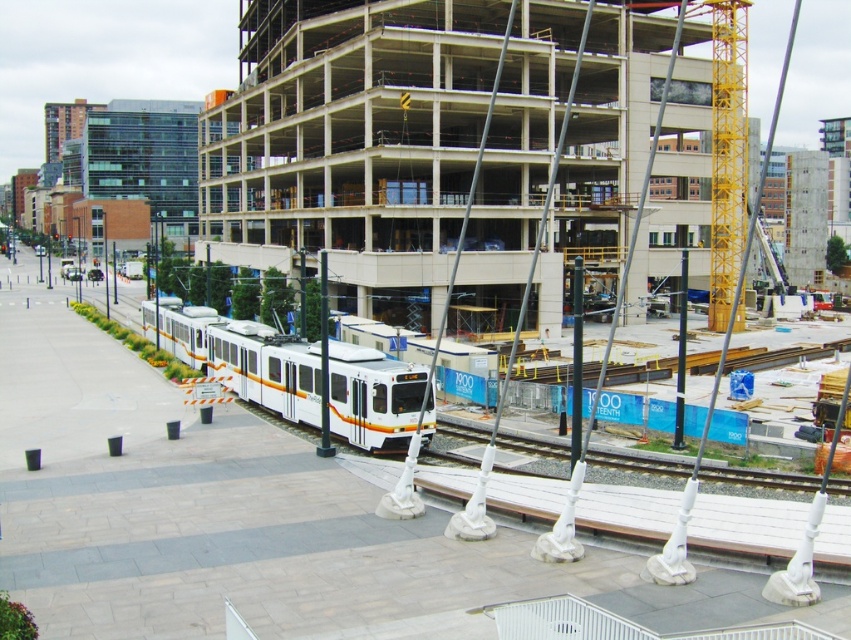
Is point (343, 420) positioned in front of point (630, 451)?

Yes, point (343, 420) is closer to viewer.

Locate an element on the screen. white glossy passenger train at center is located at coordinates pyautogui.click(x=241, y=356).

Where is `white glossy passenger train at center`? This screenshot has height=640, width=851. white glossy passenger train at center is located at coordinates (241, 356).

Between white concrete building at center and gray metallic train track at center, which one is positioned lower?

Positioned lower is gray metallic train track at center.

Is white concrete building at center thinner than gray metallic train track at center?

No.

Locate an element on the screen. The height and width of the screenshot is (640, 851). white concrete building at center is located at coordinates (255, 518).

Is point (300, 529) farther from viewer compared to point (214, 342)?

No, it is not.

Can you confirm if white concrete building at center is taller than white glossy passenger train at center?

In fact, white concrete building at center may be shorter than white glossy passenger train at center.

Measure the distance between point [163,508] and camera.

The distance of point [163,508] from camera is 18.40 meters.

At what (x,y) coordinates should I click in order to perform the action: click on white concrete building at center. Please return your answer as a coordinate pair (x, y). This screenshot has width=851, height=640. Looking at the image, I should click on (255, 518).